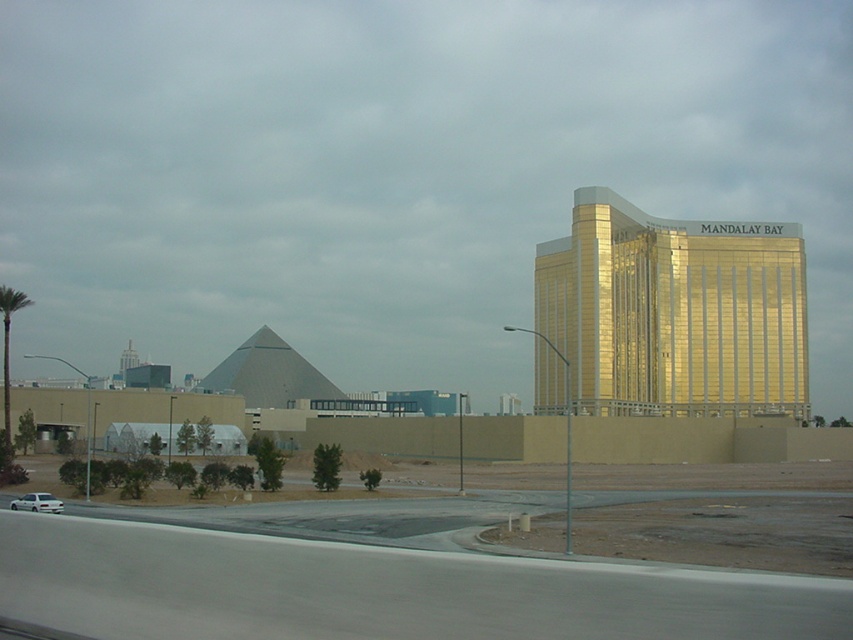
Question: Is green leafy palm tree at left behind white matte car at lower left?

Choices:
 (A) yes
 (B) no

Answer: (A)

Question: Considering the relative positions of gray asphalt highway at lower left and green leafy palm tree at left in the image provided, where is gray asphalt highway at lower left located with respect to green leafy palm tree at left?

Choices:
 (A) left
 (B) right

Answer: (B)

Question: Based on their relative distances, which object is nearer to the gold reflective building at right?

Choices:
 (A) gray metallic pyramid at center-left
 (B) white matte car at lower left

Answer: (A)

Question: Is gray asphalt highway at lower left positioned before gray metallic pyramid at center-left?

Choices:
 (A) yes
 (B) no

Answer: (A)

Question: Which point appears farthest from the camera in this image?

Choices:
 (A) (4, 392)
 (B) (753, 605)

Answer: (A)

Question: Which object is closer to the camera taking this photo?

Choices:
 (A) gray asphalt highway at lower left
 (B) green leafy palm tree at left
 (C) white matte car at lower left
 (D) gold reflective building at right

Answer: (A)